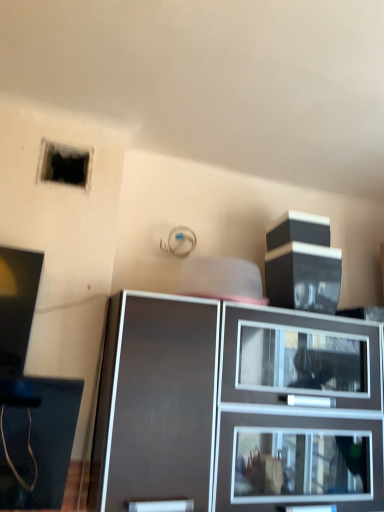
Question: Would you consider black matte hole at upper left to be distant from matte black cabinet at center?

Choices:
 (A) yes
 (B) no

Answer: (B)

Question: Considering the relative sizes of black matte hole at upper left and matte black cabinet at center in the image provided, is black matte hole at upper left smaller than matte black cabinet at center?

Choices:
 (A) yes
 (B) no

Answer: (A)

Question: From a real-world perspective, is black matte hole at upper left below matte black cabinet at center?

Choices:
 (A) no
 (B) yes

Answer: (A)

Question: Is black matte hole at upper left to the right of matte black cabinet at center from the viewer's perspective?

Choices:
 (A) no
 (B) yes

Answer: (A)

Question: From the image's perspective, is black matte hole at upper left under matte black cabinet at center?

Choices:
 (A) yes
 (B) no

Answer: (B)

Question: Can you confirm if black matte hole at upper left is positioned to the left of matte black cabinet at center?

Choices:
 (A) no
 (B) yes

Answer: (B)

Question: Is matte black cabinet at center oriented towards black matte hole at upper left?

Choices:
 (A) yes
 (B) no

Answer: (B)

Question: From a real-world perspective, is matte black cabinet at center located higher than black matte hole at upper left?

Choices:
 (A) no
 (B) yes

Answer: (A)

Question: Is black matte hole at upper left at the back of matte black cabinet at center?

Choices:
 (A) yes
 (B) no

Answer: (B)

Question: Does matte black cabinet at center have a greater height compared to black matte hole at upper left?

Choices:
 (A) no
 (B) yes

Answer: (B)

Question: Does matte black cabinet at center have a larger size compared to black matte hole at upper left?

Choices:
 (A) no
 (B) yes

Answer: (B)

Question: Considering the relative sizes of matte black cabinet at center and black matte hole at upper left in the image provided, is matte black cabinet at center smaller than black matte hole at upper left?

Choices:
 (A) yes
 (B) no

Answer: (B)

Question: Visually, is matte black cabinet at center positioned to the left or to the right of black matte hole at upper left?

Choices:
 (A) right
 (B) left

Answer: (A)